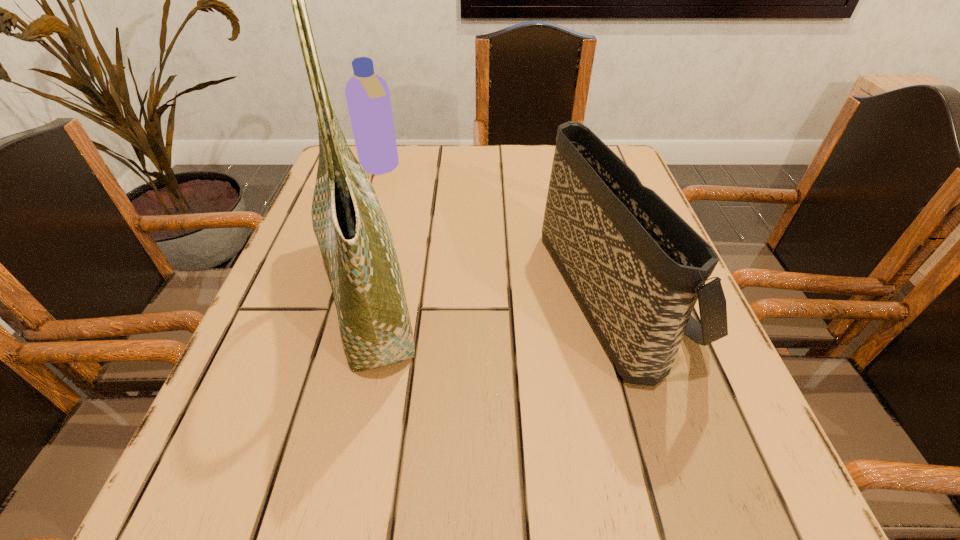
Locate an element on the screen. The width and height of the screenshot is (960, 540). vacant space that satisfies the following two spatial constraints: 1. on the back side of the handbag; 2. on the left side of the shopping bag is located at coordinates (369, 289).